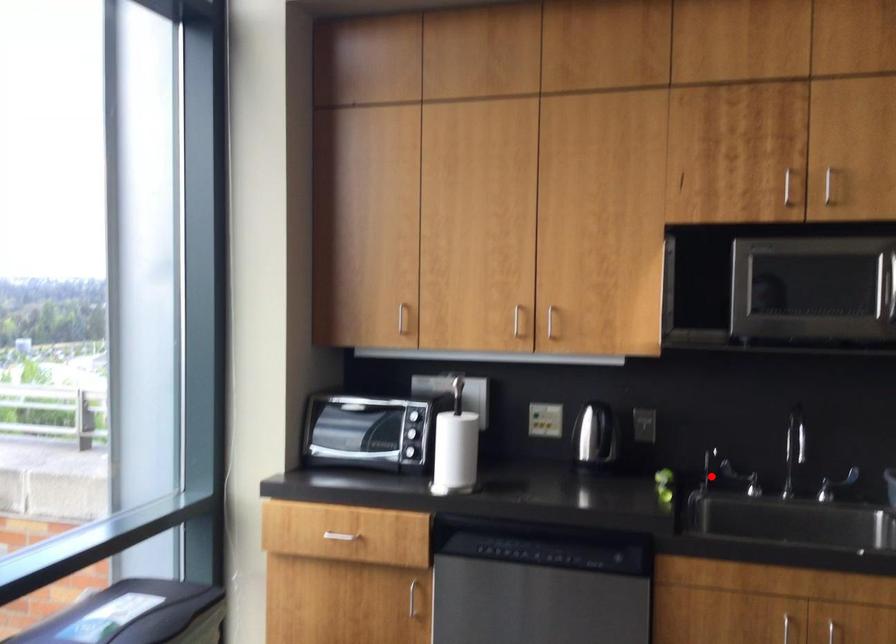
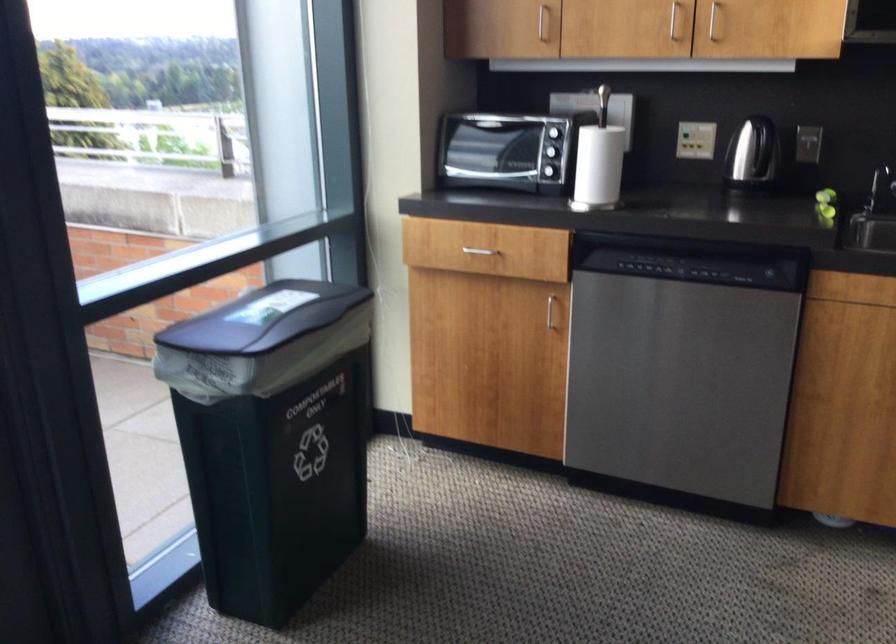
Find the pixel in the second image that matches the highlighted location in the first image.

(879, 187)